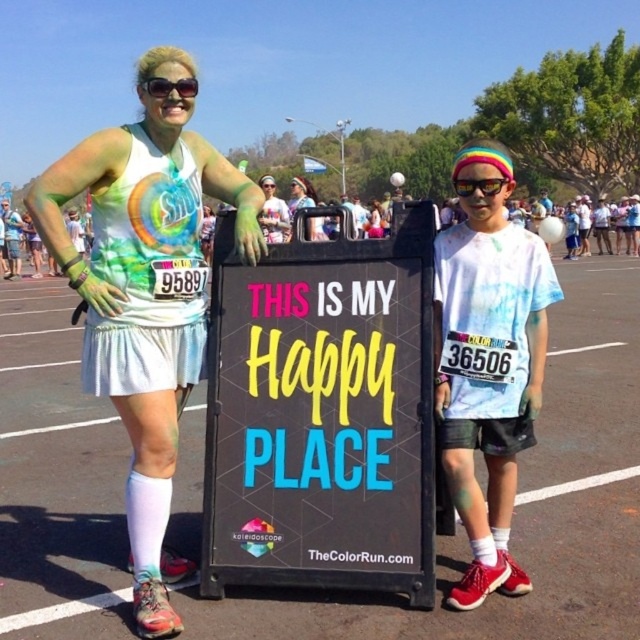
You are a photographer at the Color Run event. You want to capture a photo of both the sunglasses at upper center and the multicolored plastic goggles at center in the same frame. Based on their positions, which object should you focus on first to ensure both are in the frame?

Since the sunglasses at upper center is located above the multicolored plastic goggles at center, you should focus on the sunglasses at upper center first to ensure both are in the frame.